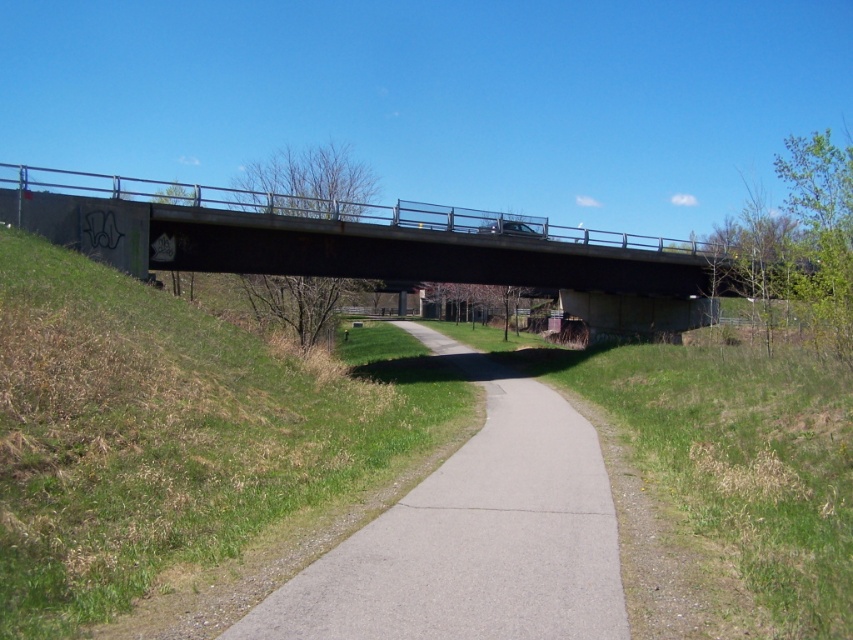
Which is in front, point (566, 620) or point (300, 220)?

Point (566, 620)

Is gray asphalt path at center shorter than concrete bridge at upper center?

Correct, gray asphalt path at center is not as tall as concrete bridge at upper center.

Which is behind, point (270, 624) or point (659, 275)?

Point (659, 275)

Where is `gray asphalt path at center`? This screenshot has width=853, height=640. gray asphalt path at center is located at coordinates (474, 536).